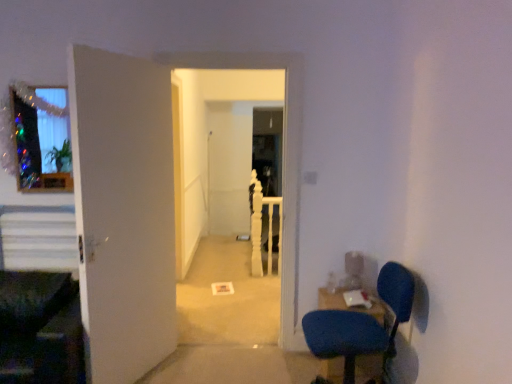
Where is `free location above blue fabric table at lower right (from a real-world perspective)`? The width and height of the screenshot is (512, 384). free location above blue fabric table at lower right (from a real-world perspective) is located at coordinates (346, 292).